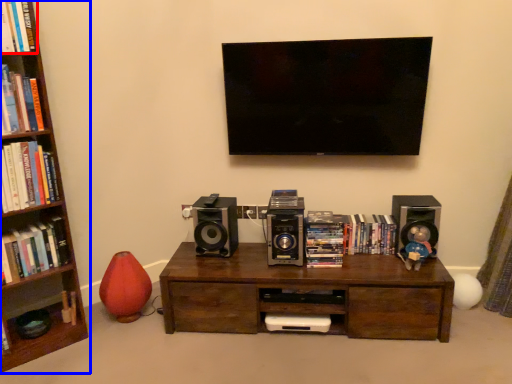
Question: Which of the following is the closest to the observer, book (highlighted by a red box) or bookcase (highlighted by a blue box)?

Choices:
 (A) book
 (B) bookcase

Answer: (B)